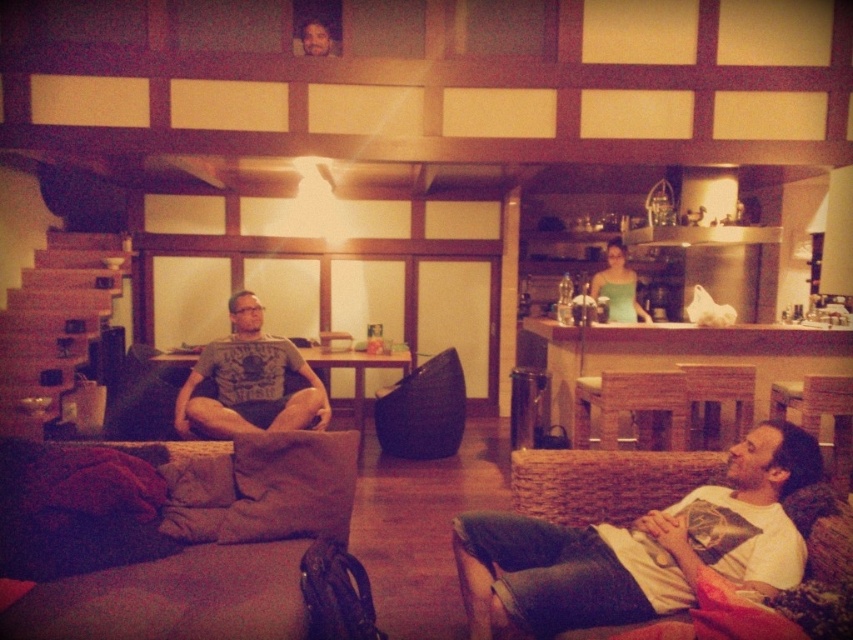
You are planning to place a decorative pillow on the sofa that is wider. Which sofa should you choose between the dark gray fabric couch at lower left and the white cotton shirt at lower right?

The dark gray fabric couch at lower left is wider than the white cotton shirt at lower right, so you should choose the dark gray fabric couch at lower left to place the decorative pillow.

You are standing in the living room and want to move from the dark gray fabric couch at lower left to the white cotton shirt at lower right. Which direction should you move?

You should move to the right to reach the white cotton shirt at lower right from the dark gray fabric couch at lower left, since the couch is to the left of the shirt.

You are organizing a clothing donation drive and need to determine which item takes up more space in the donation box. Based on the image, which clothing item between the white cotton shirt at lower right and the green matte tank top at center is wider?

The white cotton shirt at lower right is wider than the green matte tank top at center, so it takes up more space in the donation box.